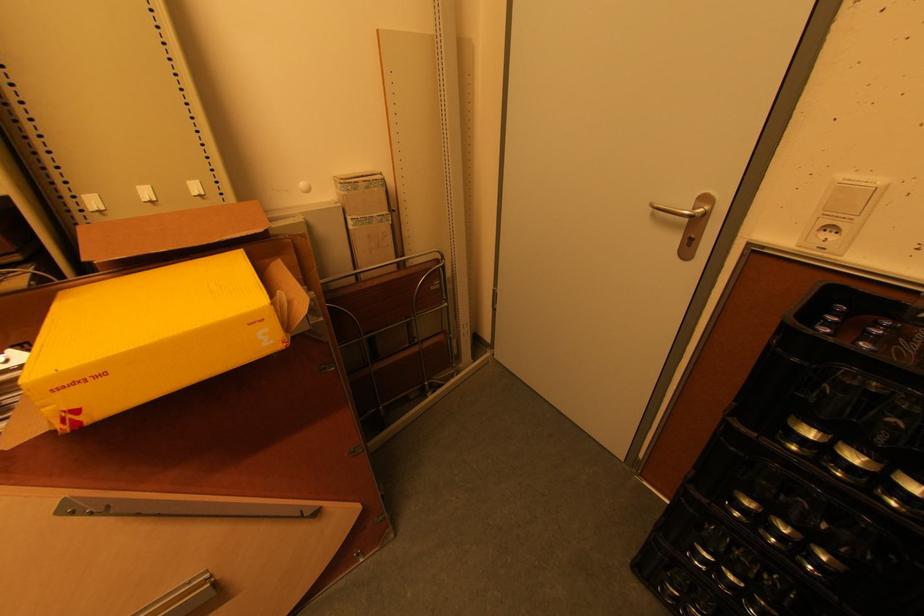
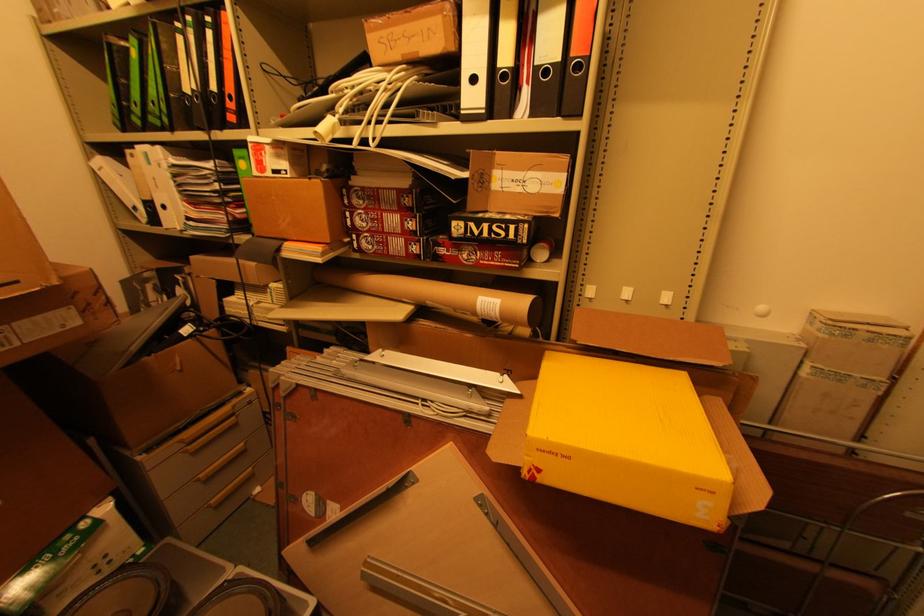
Question: The camera is either moving clockwise (left) or counter-clockwise (right) around the object. The first image is from the beginning of the video and the second image is from the end. Is the camera moving left or right when shooting the video?

Choices:
 (A) Left
 (B) Right

Answer: (B)